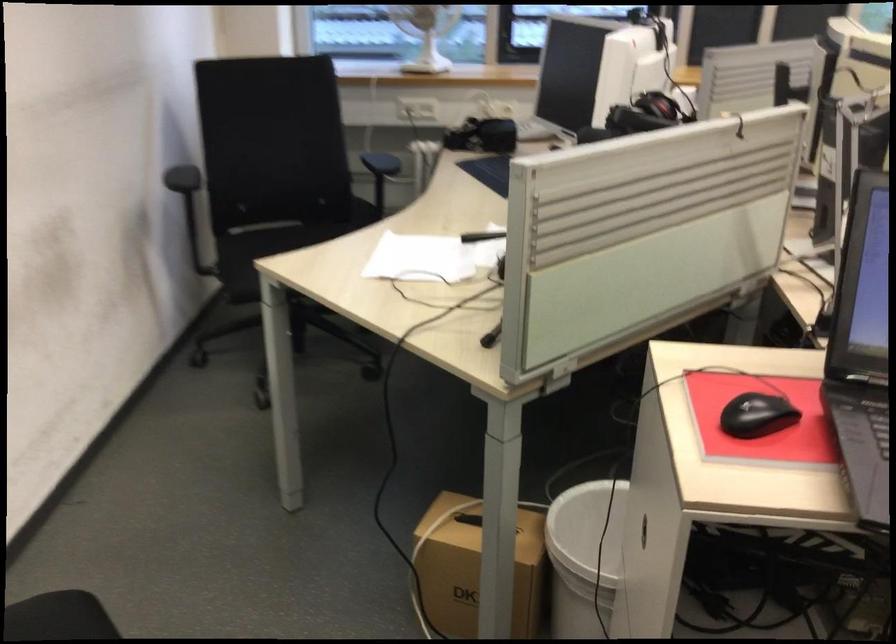
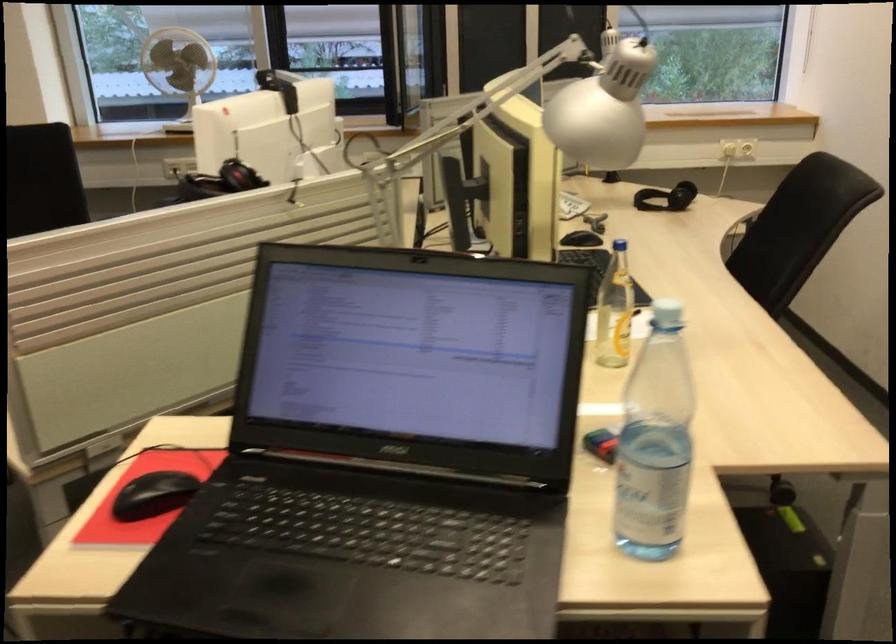
Question: I am providing you with two images of the same scene from different viewpoints. After the viewpoint changes to image2, which objects are now occluded?

Choices:
 (A) light blue bottle cap
 (B) black headphones
 (C) white paper sheet
 (D) white trash bag edge

Answer: (C)